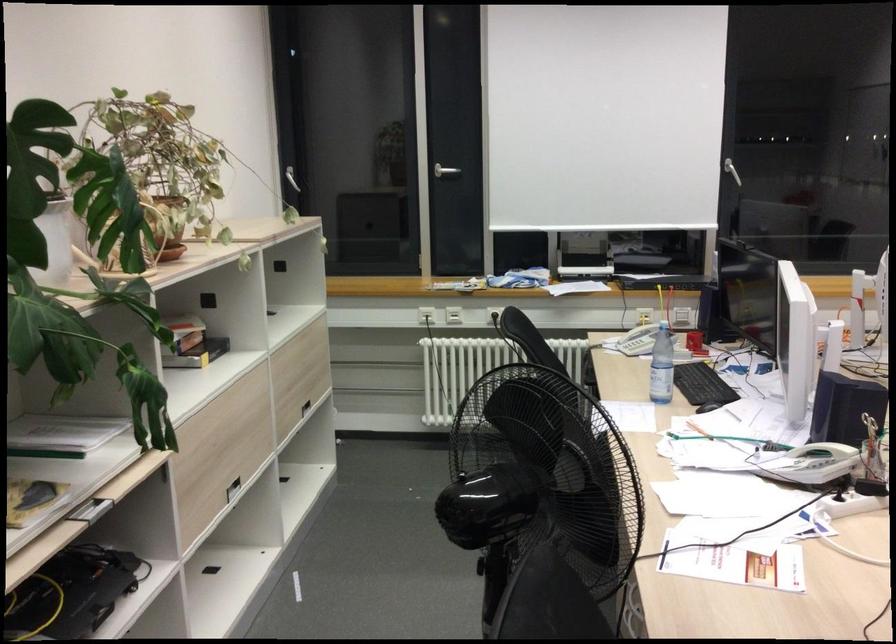
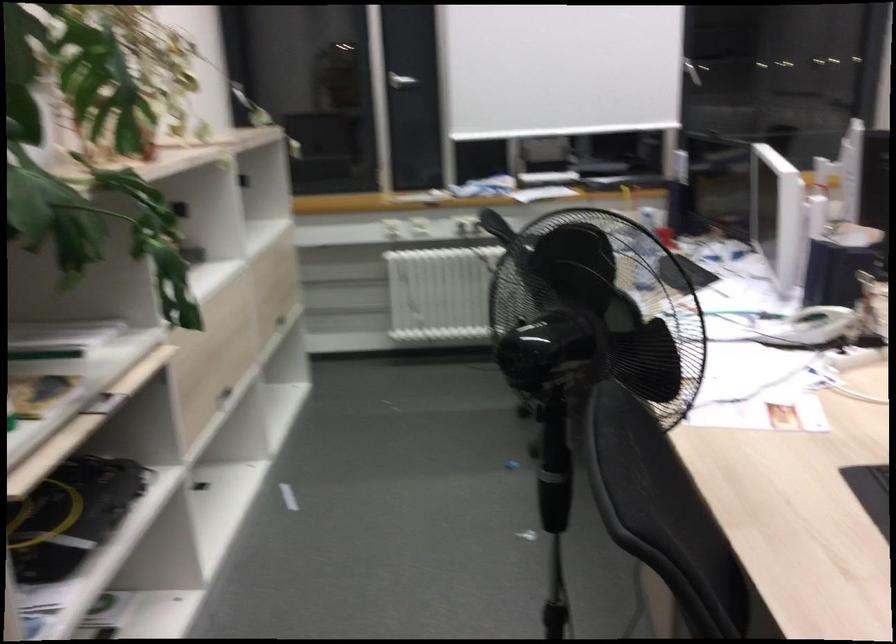
Locate, in the second image, the point that corresponds to the point at 298,401 in the first image.

(276, 313)